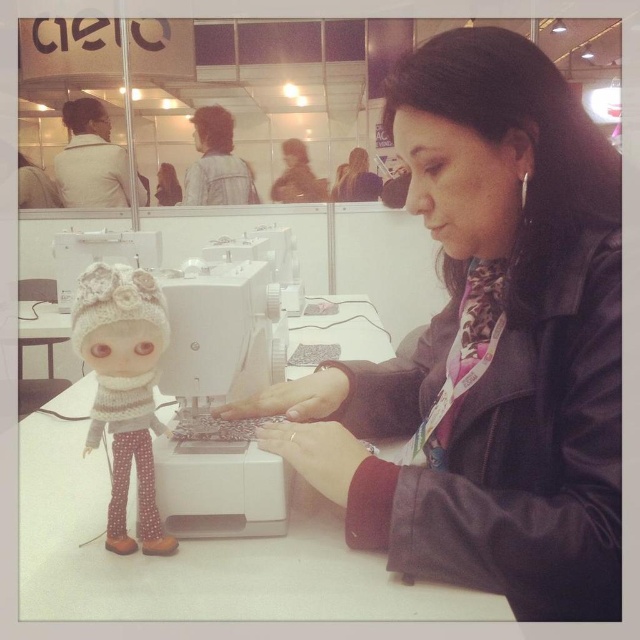
Image resolution: width=640 pixels, height=640 pixels. Describe the element at coordinates (124, 388) in the screenshot. I see `white knitted doll at lower left` at that location.

Does white knitted doll at lower left have a smaller size compared to leather jacket at upper center?

Yes.

I want to click on white knitted doll at lower left, so click(124, 388).

The width and height of the screenshot is (640, 640). I want to click on white knitted doll at lower left, so click(x=124, y=388).

Is point (497, 280) closer to viewer compared to point (227, 298)?

No.

Between point (448, 525) and point (214, 310), which one is positioned in front?

Point (448, 525)

Is point (445, 180) positioned after point (284, 486)?

Yes, it is.

Where is `leather jacket at center`? leather jacket at center is located at coordinates (488, 346).

Can you confirm if leather jacket at center is positioned above leather jacket at upper center?

Incorrect, leather jacket at center is not positioned above leather jacket at upper center.

Is leather jacket at center smaller than leather jacket at upper center?

Incorrect, leather jacket at center is not smaller in size than leather jacket at upper center.

Is point (614, 353) positioned behind point (237, 170)?

No, it is not.

Where is `leather jacket at center`? This screenshot has width=640, height=640. leather jacket at center is located at coordinates (488, 346).